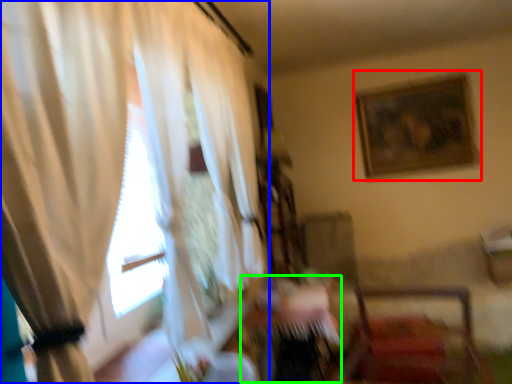
Question: Which object is the closest to the picture frame (highlighted by a red box)? Choose among these: curtain (highlighted by a blue box) or table (highlighted by a green box).

Choices:
 (A) curtain
 (B) table

Answer: (B)